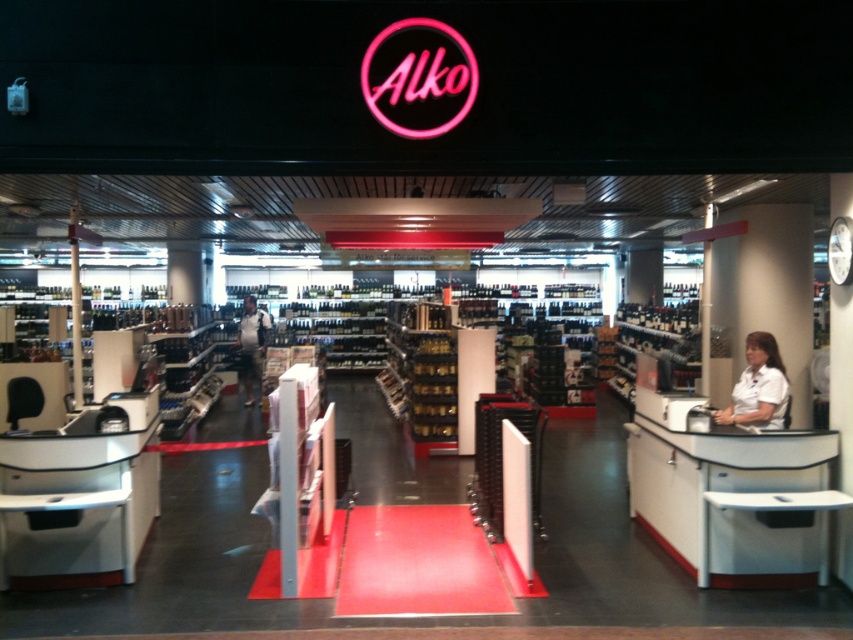
Question: Which point is farther from the camera taking this photo?

Choices:
 (A) (248, 388)
 (B) (734, 403)

Answer: (A)

Question: Does white smooth shirt at right lie behind dark blue jeans at center?

Choices:
 (A) yes
 (B) no

Answer: (B)

Question: Does white smooth shirt at right appear under dark blue jeans at center?

Choices:
 (A) no
 (B) yes

Answer: (A)

Question: Does white smooth shirt at right appear over dark blue jeans at center?

Choices:
 (A) no
 (B) yes

Answer: (B)